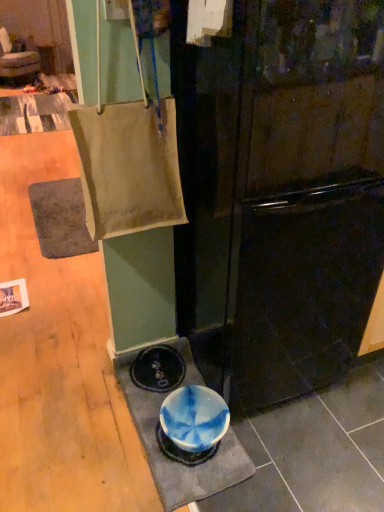
Describe the element at coordinates (306, 198) in the screenshot. Image resolution: width=384 pixels, height=512 pixels. I see `transparent plastic screen door at lower right` at that location.

Locate an element on the screen. transparent plastic screen door at lower right is located at coordinates (306, 198).

Find the location of a particular element. The image size is (384, 512). transparent plastic screen door at lower right is located at coordinates (306, 198).